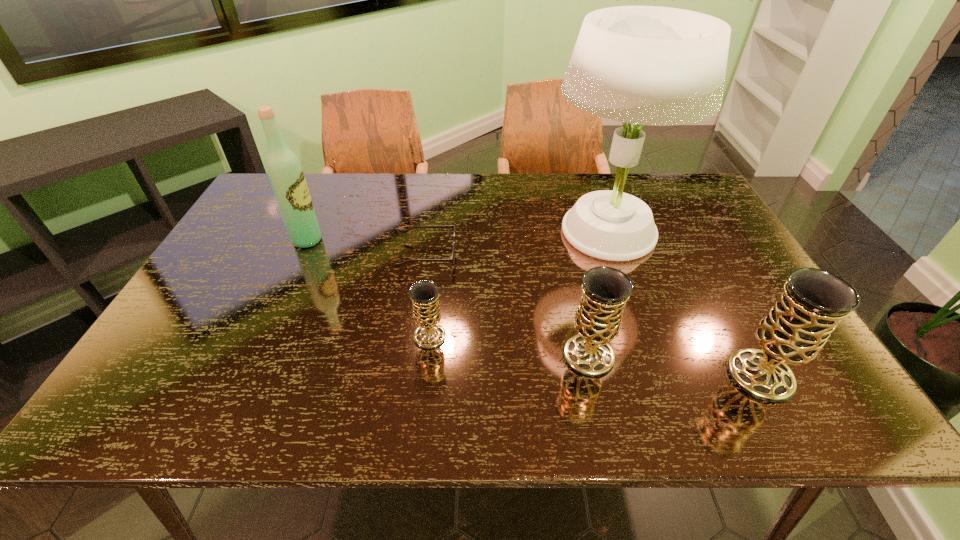
This screenshot has width=960, height=540. I want to click on free space between the second chalice from right to left and the sunglasses, so click(508, 306).

The height and width of the screenshot is (540, 960). Find the location of `vacant area between the second tallest object and the leftmost chalice`. vacant area between the second tallest object and the leftmost chalice is located at coordinates (369, 288).

Find the location of a particular element. Image resolution: width=960 pixels, height=540 pixels. blank region between the second shortest chalice and the rightmost chalice is located at coordinates (675, 366).

Point out which object is positioned as the second nearest to the rightmost chalice. Please provide its 2D coordinates. Your answer should be formatted as a tuple, i.e. [(x, y)], where the tuple contains the x and y coordinates of a point satisfying the conditions above.

[(647, 65)]

Identify which object is the nearest to the shortest chalice. Please provide its 2D coordinates. Your answer should be formatted as a tuple, i.e. [(x, y)], where the tuple contains the x and y coordinates of a point satisfying the conditions above.

[(452, 259)]

Locate which chalice is the second closest to the wine bottle. Please provide its 2D coordinates. Your answer should be formatted as a tuple, i.e. [(x, y)], where the tuple contains the x and y coordinates of a point satisfying the conditions above.

[(605, 290)]

You are a GUI agent. You are given a task and a screenshot of the screen. Output one action in this format:
    pyautogui.click(x=<x>, y=<y>)
    Task: Click on the chalice that is the closest one to the rightmost chalice
    The image size is (960, 540).
    Given the screenshot: What is the action you would take?
    pyautogui.click(x=605, y=290)

Where is `free location that satisfies the following two spatial constraints: 1. on the front-facing side of the rightmost chalice; 2. on the right side of the tallest object`? The image size is (960, 540). free location that satisfies the following two spatial constraints: 1. on the front-facing side of the rightmost chalice; 2. on the right side of the tallest object is located at coordinates (657, 376).

This screenshot has height=540, width=960. What are the coordinates of `free space in the image that satisfies the following two spatial constraints: 1. on the front-facing side of the lamp; 2. on the right side of the rightmost chalice` in the screenshot? It's located at (657, 376).

Locate an element on the screen. Image resolution: width=960 pixels, height=540 pixels. free space that satisfies the following two spatial constraints: 1. on the front-facing side of the second shortest chalice; 2. on the right side of the fifth shortest object is located at coordinates (254, 355).